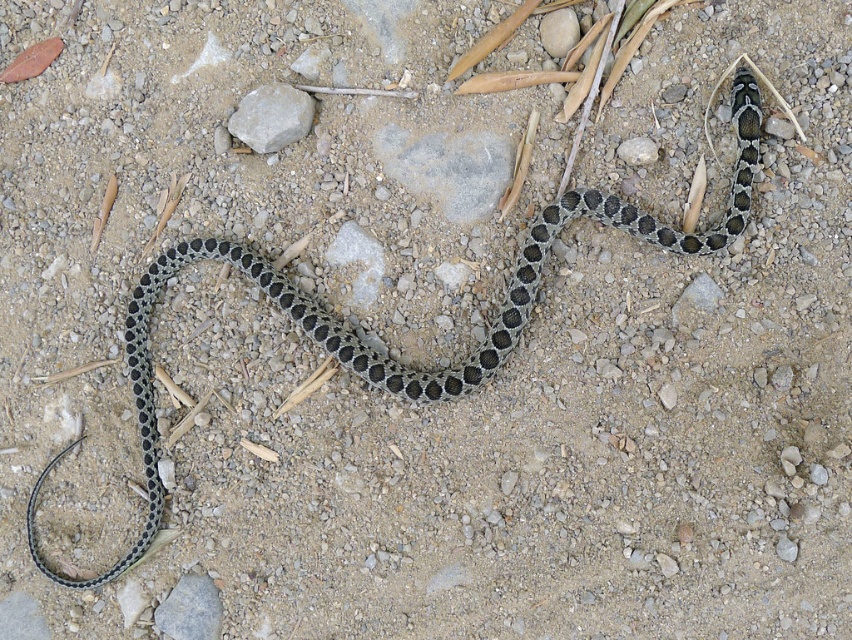
Question: Is gray rock at upper center bigger than smooth gray rock at center?

Choices:
 (A) yes
 (B) no

Answer: (A)

Question: Where is gray rock at center located in relation to gray rock at upper center in the image?

Choices:
 (A) above
 (B) below

Answer: (B)

Question: From the image, what is the correct spatial relationship of gray rock at center in relation to smooth gray rock at center?

Choices:
 (A) right
 (B) left

Answer: (B)

Question: Among these points, which one is nearest to the camera?

Choices:
 (A) (158, 620)
 (B) (494, 145)

Answer: (A)

Question: Among these points, which one is nearest to the camera?

Choices:
 (A) (561, 22)
 (B) (407, 184)

Answer: (A)

Question: Which object is closer to the camera taking this photo?

Choices:
 (A) black dotted snake at center
 (B) gray rock at center
 (C) gray rock at upper center

Answer: (A)